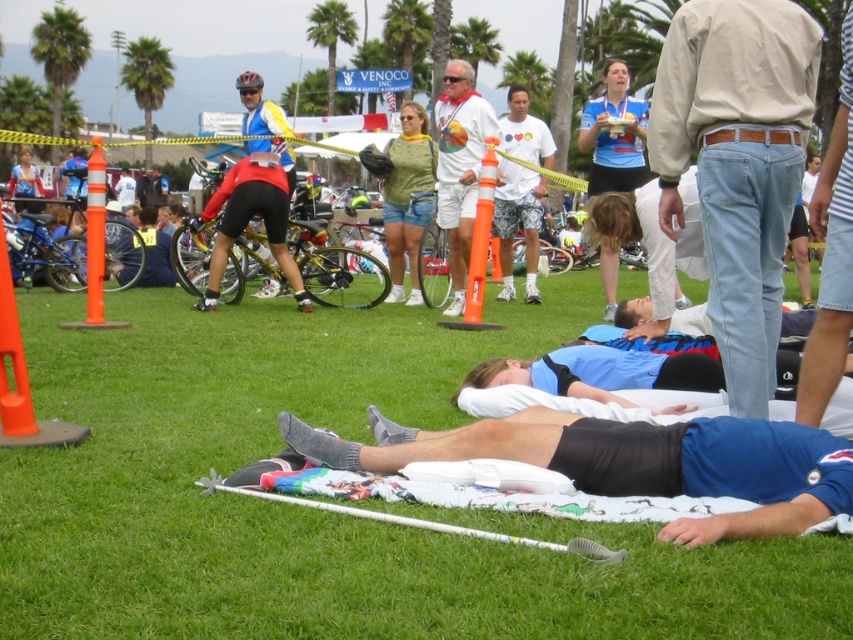
Question: Can you confirm if white cotton t-shirt at center is positioned above green jersey at center?

Choices:
 (A) no
 (B) yes

Answer: (B)

Question: Which point appears closest to the camera in this image?

Choices:
 (A) (505, 189)
 (B) (392, 272)
 (C) (701, 531)

Answer: (C)

Question: Is light brown denim jeans at upper right to the right of white matte shirt at center from the viewer's perspective?

Choices:
 (A) yes
 (B) no

Answer: (A)

Question: Does blue cotton shirt at lower right have a lesser width compared to white cotton t-shirt at center?

Choices:
 (A) no
 (B) yes

Answer: (A)

Question: Which point is farther to the camera?

Choices:
 (A) white matte shirt at center
 (B) white cotton t-shirt at center

Answer: (A)

Question: Among these points, which one is nearest to the camera?

Choices:
 (A) (602, 480)
 (B) (445, 214)

Answer: (A)